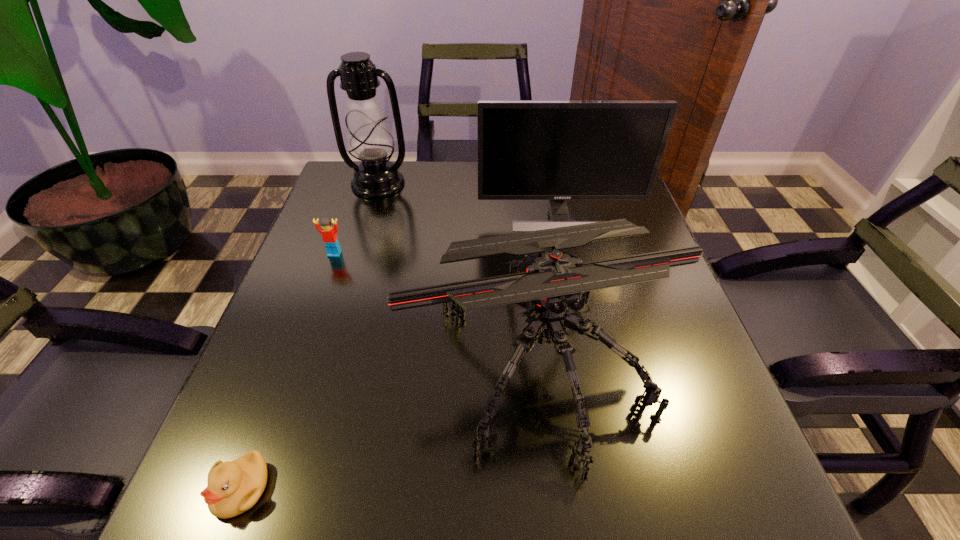
Find the location of a particular element. The height and width of the screenshot is (540, 960). oil lamp present at the far edge is located at coordinates (369, 139).

Image resolution: width=960 pixels, height=540 pixels. In order to click on monitor that is at the far edge in this screenshot , I will do `click(556, 150)`.

The height and width of the screenshot is (540, 960). Identify the location of drone positioned at the near edge. (548, 282).

At what (x,y) coordinates should I click in order to perform the action: click on duckling at the near edge. Please return your answer as a coordinate pair (x, y). The width and height of the screenshot is (960, 540). Looking at the image, I should click on (233, 487).

The height and width of the screenshot is (540, 960). I want to click on oil lamp located at the left edge, so click(369, 139).

Locate an element on the screen. The width and height of the screenshot is (960, 540). Lego at the left edge is located at coordinates (329, 234).

Find the location of `duckling present at the left edge`. duckling present at the left edge is located at coordinates (233, 487).

Locate an element on the screen. monitor at the right edge is located at coordinates click(x=556, y=150).

You are a GUI agent. You are given a task and a screenshot of the screen. Output one action in this format:
    pyautogui.click(x=<x>, y=<y>)
    Task: Click on the drone located in the right edge section of the desktop
    
    Given the screenshot: What is the action you would take?
    pyautogui.click(x=548, y=282)

At what (x,y) coordinates should I click in order to perform the action: click on object located in the far left corner section of the desktop. Please return your answer as a coordinate pair (x, y). The image size is (960, 540). Looking at the image, I should click on (369, 139).